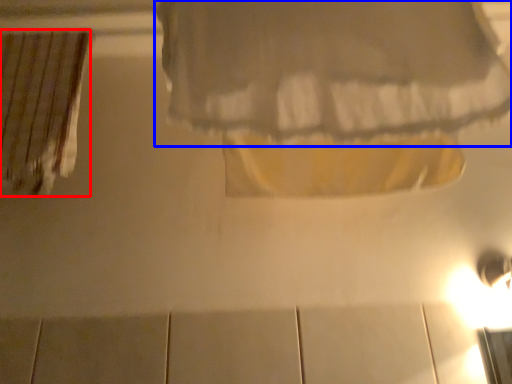
Question: Which point is further to the camera, curtain (highlighted by a red box) or curtain (highlighted by a blue box)?

Choices:
 (A) curtain
 (B) curtain

Answer: (A)